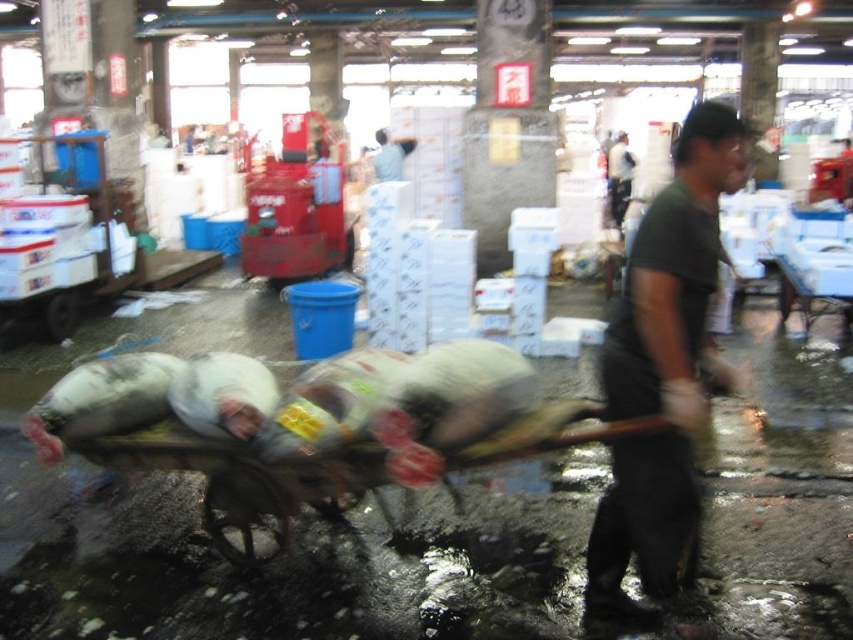
Question: Is metallic cart at center below dark green shirt at center?

Choices:
 (A) no
 (B) yes

Answer: (B)

Question: Is dark green t-shirt at center bigger than metallic cart at center?

Choices:
 (A) yes
 (B) no

Answer: (B)

Question: Which of the following is the farthest from the observer?

Choices:
 (A) (607, 170)
 (B) (685, 387)

Answer: (A)

Question: Among these objects, which one is nearest to the camera?

Choices:
 (A) dark green shirt at center
 (B) metallic cart at center
 (C) dark green t-shirt at center
 (D) light blue shirt at center

Answer: (C)

Question: Can you confirm if metallic cart at center is smaller than dark green shirt at center?

Choices:
 (A) yes
 (B) no

Answer: (A)

Question: Which object is positioned farthest from the dark green shirt at center?

Choices:
 (A) light blue shirt at center
 (B) metallic cart at center
 (C) dark green t-shirt at center

Answer: (C)